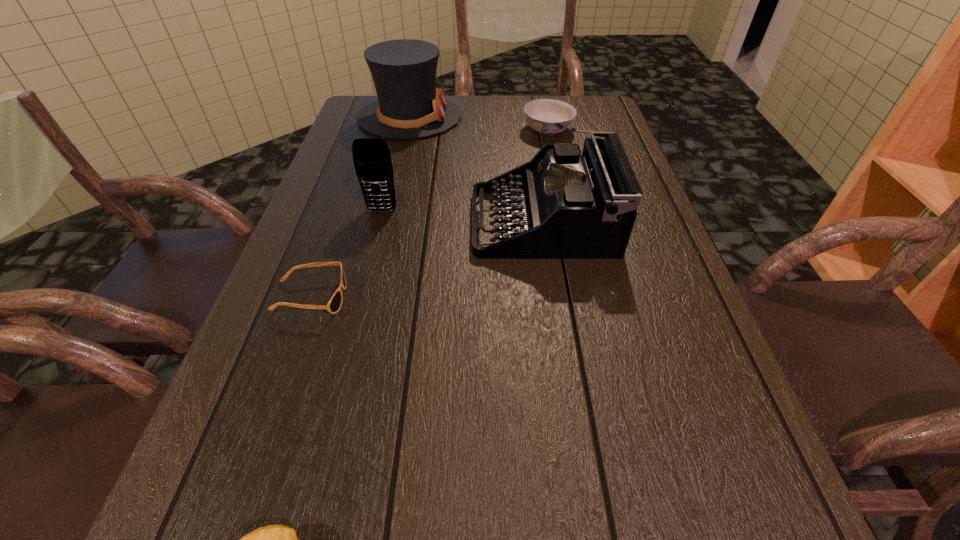
Locate an element on the screen. The image size is (960, 540). dress hat is located at coordinates (409, 106).

You are a GUI agent. You are given a task and a screenshot of the screen. Output one action in this format:
    pyautogui.click(x=<x>, y=<y>)
    Task: Click on the cellular telephone
    
    Given the screenshot: What is the action you would take?
    pyautogui.click(x=371, y=156)

Image resolution: width=960 pixels, height=540 pixels. I want to click on typewriter, so click(570, 206).

At what (x,y) coordinates should I click in order to perform the action: click on bowl. Please return your answer as a coordinate pair (x, y). Looking at the image, I should click on (548, 117).

This screenshot has width=960, height=540. Identify the location of sunglasses. (333, 306).

Where is `the shortest object`? the shortest object is located at coordinates (333, 306).

Identify the location of free space located with goggles on the front of the dress hat. This screenshot has height=540, width=960. (538, 117).

Locate an element on the screen. The width and height of the screenshot is (960, 540). vacant space located 0.370m on the screen of the cellular telephone is located at coordinates (347, 350).

Where is `free space located on the typing side of the typewriter`? Image resolution: width=960 pixels, height=540 pixels. free space located on the typing side of the typewriter is located at coordinates (303, 221).

Where is `blank area located 0.380m on the typing side of the typewriter`? This screenshot has width=960, height=540. blank area located 0.380m on the typing side of the typewriter is located at coordinates (303, 221).